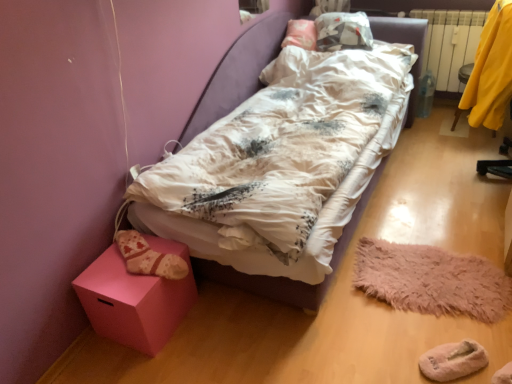
Question: From the image's perspective, does yellow fabric at right appear lower than fuzzy pink mat at lower right?

Choices:
 (A) yes
 (B) no

Answer: (B)

Question: Is yellow fabric at right positioned in front of fuzzy pink mat at lower right?

Choices:
 (A) no
 (B) yes

Answer: (A)

Question: From a real-world perspective, is yellow fabric at right on top of fuzzy pink mat at lower right?

Choices:
 (A) no
 (B) yes

Answer: (B)

Question: Could you tell me if yellow fabric at right is facing fuzzy pink mat at lower right?

Choices:
 (A) yes
 (B) no

Answer: (B)

Question: Would you consider yellow fabric at right to be distant from fuzzy pink mat at lower right?

Choices:
 (A) no
 (B) yes

Answer: (A)

Question: Looking at their shapes, would you say knitted woolen sock at lower left is wider or thinner than fuzzy pink mat at lower right?

Choices:
 (A) wide
 (B) thin

Answer: (B)

Question: Does point (133, 256) appear closer or farther from the camera than point (458, 276)?

Choices:
 (A) closer
 (B) farther

Answer: (A)

Question: Considering the relative positions of knitted woolen sock at lower left and fuzzy pink mat at lower right in the image provided, is knitted woolen sock at lower left to the left or to the right of fuzzy pink mat at lower right?

Choices:
 (A) right
 (B) left

Answer: (B)

Question: Choose the correct answer: Is knitted woolen sock at lower left inside fuzzy pink mat at lower right or outside it?

Choices:
 (A) outside
 (B) inside

Answer: (A)

Question: Based on their sizes in the image, would you say yellow fabric at right is bigger or smaller than white cotton bed at center?

Choices:
 (A) small
 (B) big

Answer: (A)

Question: In terms of height, does yellow fabric at right look taller or shorter compared to white cotton bed at center?

Choices:
 (A) short
 (B) tall

Answer: (A)

Question: Is yellow fabric at right spatially inside white cotton bed at center, or outside of it?

Choices:
 (A) outside
 (B) inside

Answer: (A)

Question: Is point [x=494, y=61] closer or farther from the camera than point [x=293, y=301]?

Choices:
 (A) closer
 (B) farther

Answer: (B)

Question: Based on their positions, is white plastic radiator at right located to the left or right of knitted woolen sock at lower left?

Choices:
 (A) right
 (B) left

Answer: (A)

Question: From the image's perspective, is white plastic radiator at right located above or below knitted woolen sock at lower left?

Choices:
 (A) above
 (B) below

Answer: (A)